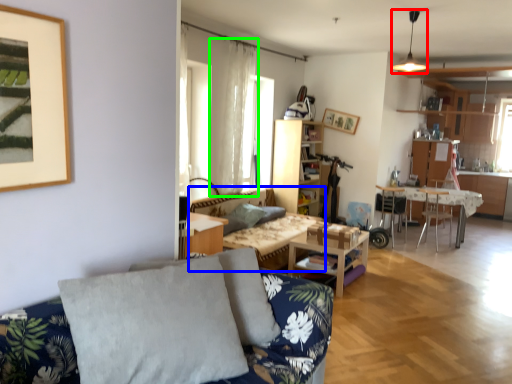
Question: Which object is the closest to the light fixture (highlighted by a red box)? Choose among these: couch (highlighted by a blue box) or curtain (highlighted by a green box).

Choices:
 (A) couch
 (B) curtain

Answer: (B)